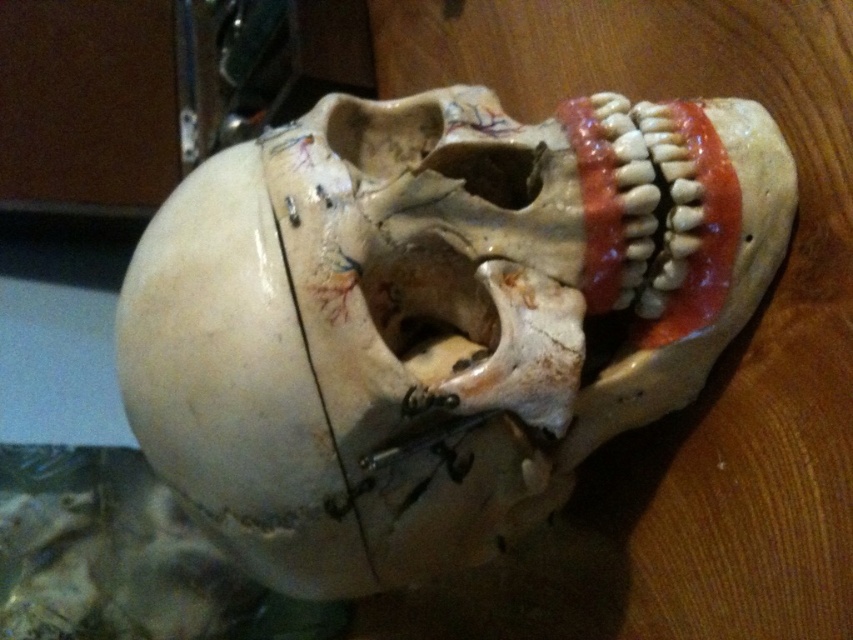
Question: Among these points, which one is farthest from the camera?

Choices:
 (A) (566, 116)
 (B) (593, 305)

Answer: (B)

Question: Which point appears closest to the camera in this image?

Choices:
 (A) (723, 275)
 (B) (193, 426)

Answer: (B)

Question: Is white matte skull at center positioned in front of smooth porcelain teeth at right?

Choices:
 (A) yes
 (B) no

Answer: (A)

Question: Does white matte skull at center appear under smooth porcelain teeth at right?

Choices:
 (A) no
 (B) yes

Answer: (B)

Question: Is white matte skull at center wider than smooth porcelain teeth at right?

Choices:
 (A) no
 (B) yes

Answer: (B)